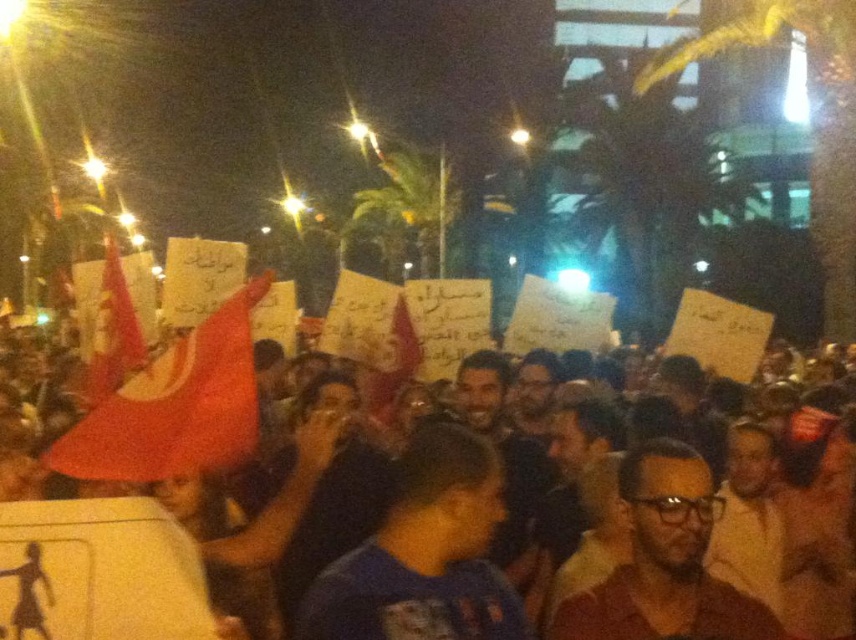
Question: Can you confirm if red fabric flags at center is thinner than matte red flag at center-left?

Choices:
 (A) no
 (B) yes

Answer: (A)

Question: From the image, what is the correct spatial relationship of matte red flag at center-left in relation to red fabric flag at left?

Choices:
 (A) below
 (B) above

Answer: (A)

Question: Which point is farther to the camera?

Choices:
 (A) red fabric flag at left
 (B) red fabric flags at center
 (C) matte red flag at center-left

Answer: (A)

Question: Which point is farther to the camera?

Choices:
 (A) red fabric flags at center
 (B) red fabric flag at left

Answer: (B)

Question: Among these points, which one is farthest from the camera?

Choices:
 (A) (229, 540)
 (B) (108, 280)

Answer: (B)

Question: Can you confirm if red fabric flags at center is wider than red fabric flag at left?

Choices:
 (A) no
 (B) yes

Answer: (A)